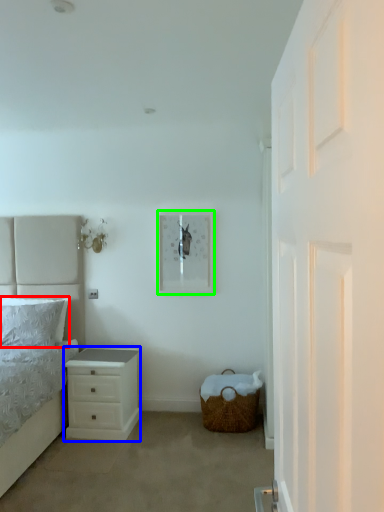
Question: Based on their relative distances, which object is nearer to pillow (highlighted by a red box)? Choose from chest of drawers (highlighted by a blue box) and picture frame (highlighted by a green box).

Choices:
 (A) chest of drawers
 (B) picture frame

Answer: (A)